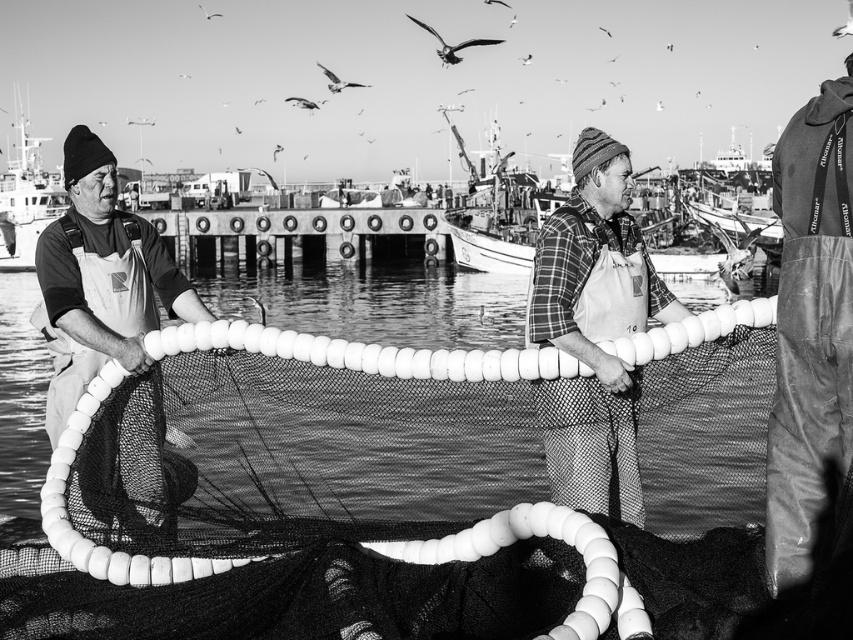
Question: Which point is farther from the camera taking this photo?

Choices:
 (A) (146, 307)
 (B) (560, 435)
 (C) (13, 208)

Answer: (C)

Question: Does leather pants at lower right have a greater width compared to plaid fabric shirt at center?

Choices:
 (A) yes
 (B) no

Answer: (A)

Question: Which point is closer to the camera?

Choices:
 (A) (26, 108)
 (B) (339, 257)
 (C) (158, 273)
 (D) (624, 268)

Answer: (D)

Question: Which object is farther from the camera taking this photo?

Choices:
 (A) metallic boat at left
 (B) plaid fabric shirt at center
 (C) matte white net at left
 (D) smooth concrete pier at center

Answer: (A)

Question: Can you confirm if white mesh net at center is positioned above matte white net at left?

Choices:
 (A) no
 (B) yes

Answer: (A)

Question: Is matte white net at left to the right of metallic boat at left from the viewer's perspective?

Choices:
 (A) yes
 (B) no

Answer: (A)